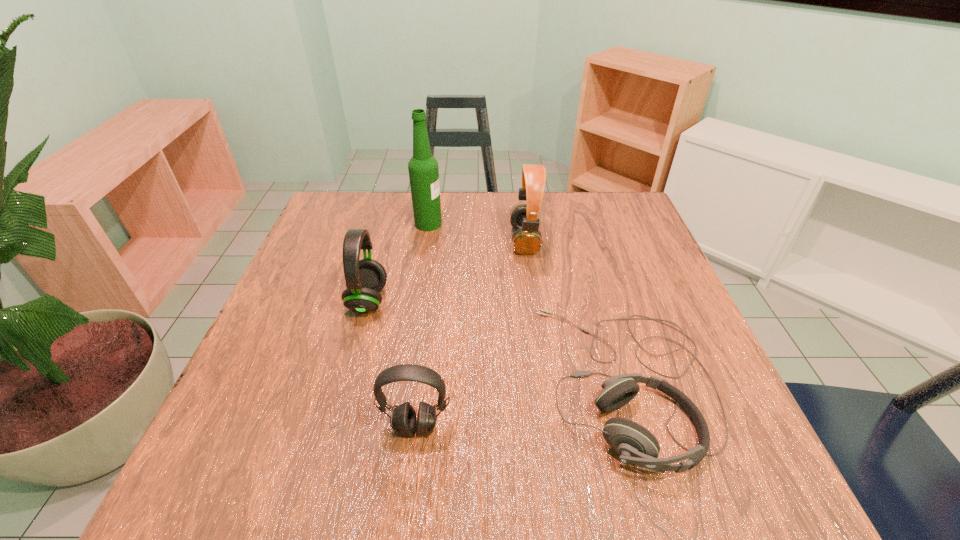
In order to click on free space between the leftmost headset and the shortest object in this screenshot , I will do `click(498, 342)`.

Where is `free area in between the leftmost object and the shortest object`? free area in between the leftmost object and the shortest object is located at coordinates (498, 342).

The width and height of the screenshot is (960, 540). I want to click on vacant space that's between the farthest headset and the third headset from right to left, so click(x=470, y=334).

Find the location of a particular element. empty space that is in between the shortest headset and the leftmost object is located at coordinates (498, 342).

This screenshot has height=540, width=960. Find the location of `free space that is in between the second headset from left to right and the shortest headset`. free space that is in between the second headset from left to right and the shortest headset is located at coordinates (522, 405).

This screenshot has height=540, width=960. I want to click on object that stands as the third closest to the second shortest headset, so click(527, 240).

In order to click on object that is the fourth closest to the beer bottle in this screenshot , I will do `click(403, 422)`.

Where is `headset that can be found as the second closest to the leftmost object`? headset that can be found as the second closest to the leftmost object is located at coordinates (527, 240).

Choose which headset is the second nearest neighbor to the tallest object. Please provide its 2D coordinates. Your answer should be formatted as a tuple, i.e. [(x, y)], where the tuple contains the x and y coordinates of a point satisfying the conditions above.

[(365, 278)]

You are a GUI agent. You are given a task and a screenshot of the screen. Output one action in this format:
    pyautogui.click(x=<x>, y=<y>)
    Task: Click on the vacant area that satisfies the following two spatial constraints: 1. on the outer surface of the shortest headset; 2. on the front-facing side of the fourth tallest object
    The height and width of the screenshot is (540, 960).
    Given the screenshot: What is the action you would take?
    pyautogui.click(x=642, y=427)